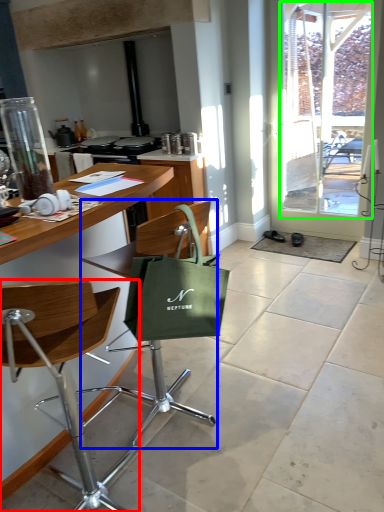
Question: Which object is the farthest from chair (highlighted by a red box)? Choose among these: chair (highlighted by a blue box) or window screen (highlighted by a green box).

Choices:
 (A) chair
 (B) window screen

Answer: (B)